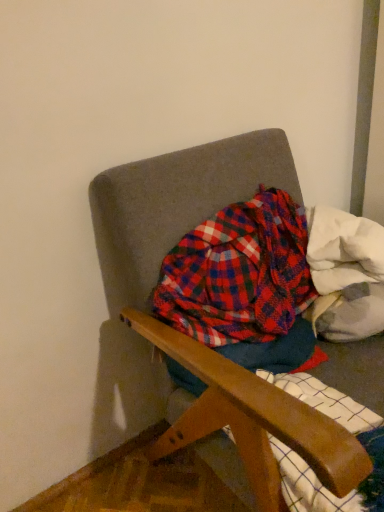
Question: From a real-world perspective, is white fluffy blanket at upper right on plaid fabric at center?

Choices:
 (A) no
 (B) yes

Answer: (B)

Question: Is plaid fabric at center surrounded by white fluffy blanket at upper right?

Choices:
 (A) yes
 (B) no

Answer: (B)

Question: From the image's perspective, is white fluffy blanket at upper right on top of plaid fabric at center?

Choices:
 (A) no
 (B) yes

Answer: (B)

Question: Does white fluffy blanket at upper right appear on the left side of plaid fabric at center?

Choices:
 (A) yes
 (B) no

Answer: (B)

Question: Can you confirm if white fluffy blanket at upper right is thinner than plaid fabric at center?

Choices:
 (A) no
 (B) yes

Answer: (A)

Question: Looking at their shapes, would you say textured fabric chair at center is wider or thinner than plaid fabric at center?

Choices:
 (A) thin
 (B) wide

Answer: (B)

Question: From the image's perspective, is textured fabric chair at center located above or below plaid fabric at center?

Choices:
 (A) above
 (B) below

Answer: (B)

Question: Considering their positions, is textured fabric chair at center located in front of or behind plaid fabric at center?

Choices:
 (A) front
 (B) behind

Answer: (A)

Question: Is textured fabric chair at center to the left or to the right of plaid fabric at center in the image?

Choices:
 (A) right
 (B) left

Answer: (A)

Question: Is white fluffy blanket at upper right inside the boundaries of textured fabric chair at center, or outside?

Choices:
 (A) outside
 (B) inside

Answer: (B)

Question: In terms of size, does white fluffy blanket at upper right appear bigger or smaller than textured fabric chair at center?

Choices:
 (A) big
 (B) small

Answer: (B)

Question: Based on their positions, is white fluffy blanket at upper right located to the left or right of textured fabric chair at center?

Choices:
 (A) right
 (B) left

Answer: (A)

Question: Is white fluffy blanket at upper right wider or thinner than textured fabric chair at center?

Choices:
 (A) thin
 (B) wide

Answer: (A)

Question: Is plaid fabric at center bigger or smaller than textured fabric chair at center?

Choices:
 (A) small
 (B) big

Answer: (A)

Question: Is plaid fabric at center to the left or to the right of textured fabric chair at center in the image?

Choices:
 (A) left
 (B) right

Answer: (A)